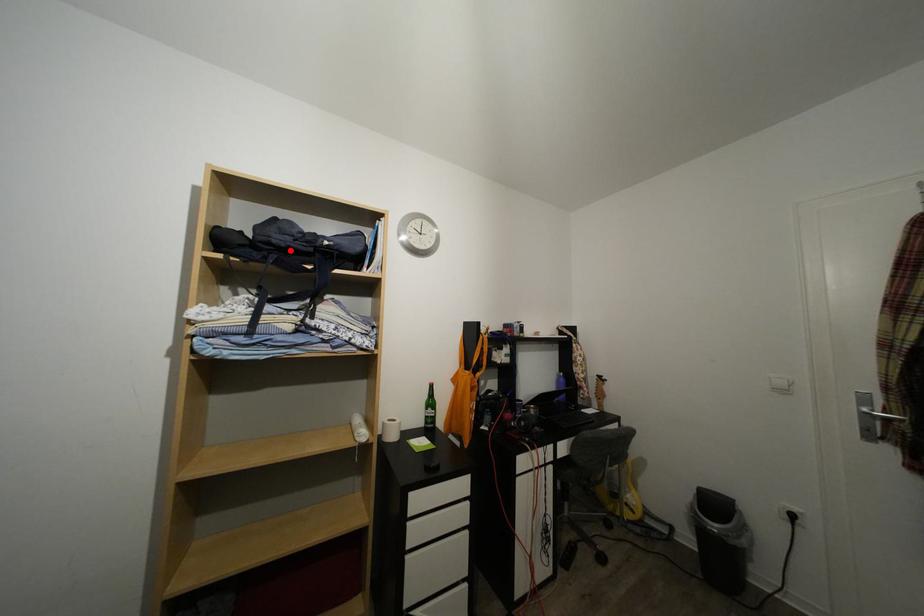
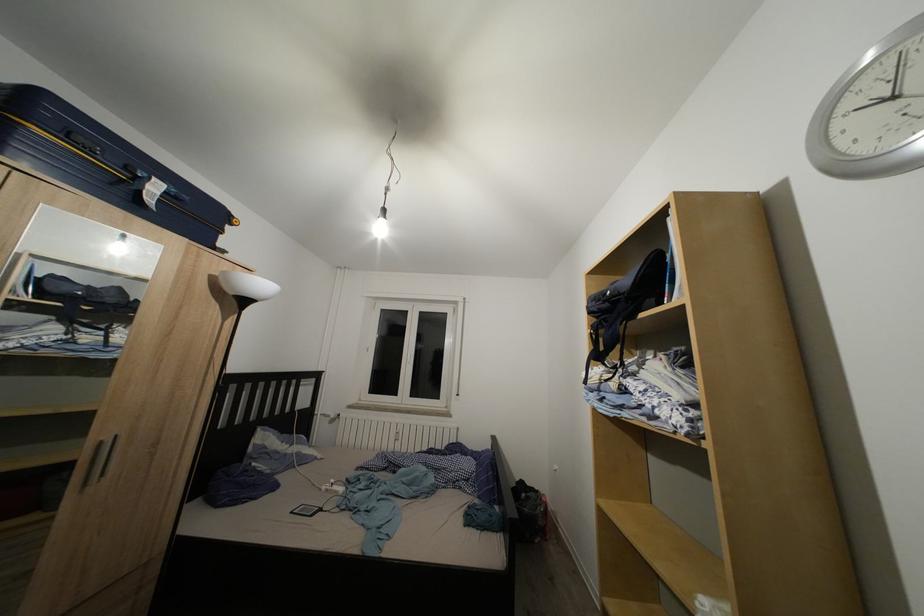
Locate, in the second image, the point that corresponds to the highlighted location in the first image.

(602, 315)